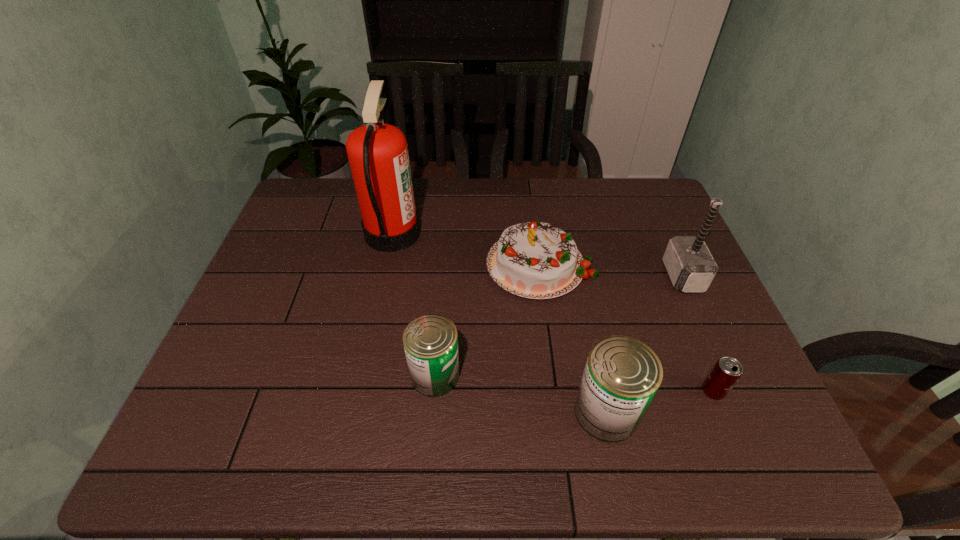
Identify the location of free space located 0.250m for striking with the head of the second tallest object. (576, 276).

Find the location of a particular element. The width and height of the screenshot is (960, 540). free space located 0.150m for striking with the head of the second tallest object is located at coordinates (612, 276).

What are the coordinates of `vacant space located 0.220m for striking with the head of the second tallest object` in the screenshot? It's located at (587, 276).

The width and height of the screenshot is (960, 540). I want to click on free space located 0.260m on the back of the cake, so click(529, 183).

This screenshot has width=960, height=540. What are the coordinates of `free space located at the nozzle of the leftmost object` in the screenshot? It's located at (509, 233).

Identify the location of vacant space located on the back of the shortest object. (660, 261).

Identify the location of object positioned at the far edge. (377, 152).

Where is `beer can located in the near edge section of the desktop`? This screenshot has width=960, height=540. beer can located in the near edge section of the desktop is located at coordinates click(726, 372).

Identify the location of hammer present at the right edge. (688, 261).

This screenshot has width=960, height=540. Identify the location of beer can that is at the right edge. (726, 372).